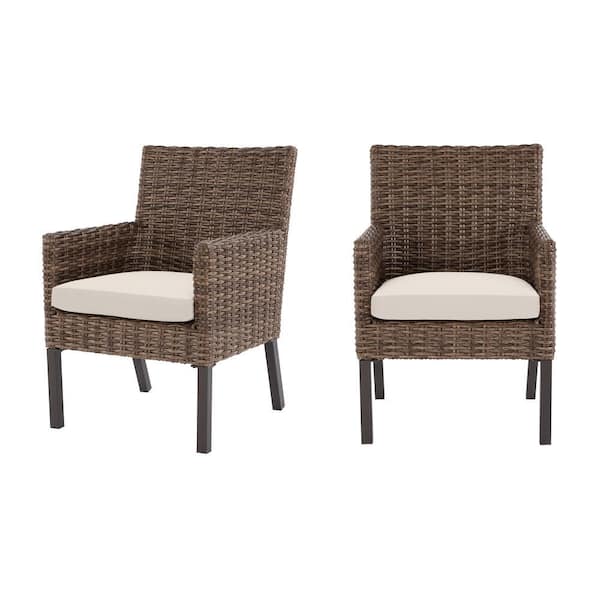
What are the coordinates of `chair legs` in the screenshot? It's located at (378, 396), (367, 428), (530, 383), (542, 412), (276, 364), (206, 411), (141, 364), (54, 374).